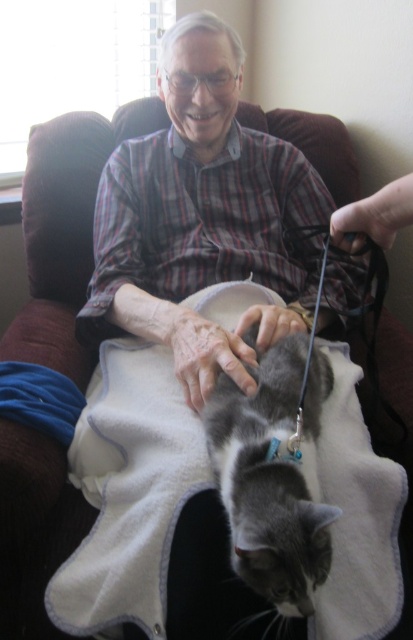
You are a photographer trying to capture a closeup of the matte plaid shirt at center. The camera is set to a focal length that requires the subject to be at least 30 inches away. Can you take the photo without moving the camera?

The matte plaid shirt at center and camera are 33.27 inches apart, so yes, the photographer can take the photo without moving the camera since the distance meets the minimum requirement of 30 inches.

You are a photographer trying to capture a closeup of the gray fur cat at center without the matte plaid shirt at center blocking the view. What adjustment should you make to your camera angle?

The matte plaid shirt at center is located above the gray fur cat at center, so you should lower your camera angle to avoid the shirt blocking the view of the cat.